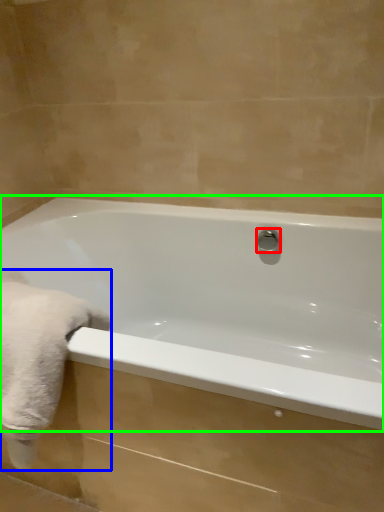
Question: Which is farther away from shower (highlighted by a red box)? bath towel (highlighted by a blue box) or bathtub (highlighted by a green box)?

Choices:
 (A) bath towel
 (B) bathtub

Answer: (A)